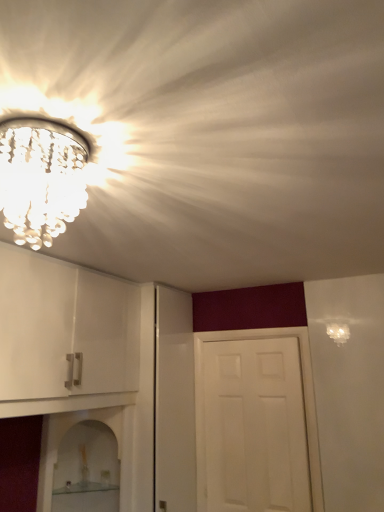
Question: From a real-world perspective, is clear crystal chandelier at upper left physically located above or below clear glass shelf at lower center, positioned as the second shelf in bottom-to-top order?

Choices:
 (A) below
 (B) above

Answer: (B)

Question: In terms of height, does clear crystal chandelier at upper left look taller or shorter compared to clear glass shelf at lower center, positioned as the second shelf in bottom-to-top order?

Choices:
 (A) tall
 (B) short

Answer: (B)

Question: Estimate the real-world distances between objects in this image. Which object is closer to the clear glass shelf at lower center, the 1th shelf positioned from the top?

Choices:
 (A) clear crystal chandelier at upper left
 (B) white matte door at center
 (C) clear glass shelf at lower left, marked as the second shelf in a top-to-bottom arrangement

Answer: (C)

Question: Based on their relative distances, which object is nearer to the clear glass shelf at lower center, positioned as the second shelf in bottom-to-top order?

Choices:
 (A) clear crystal chandelier at upper left
 (B) clear glass shelf at lower left, the 1th shelf in the bottom-to-top sequence
 (C) white matte door at center

Answer: (B)